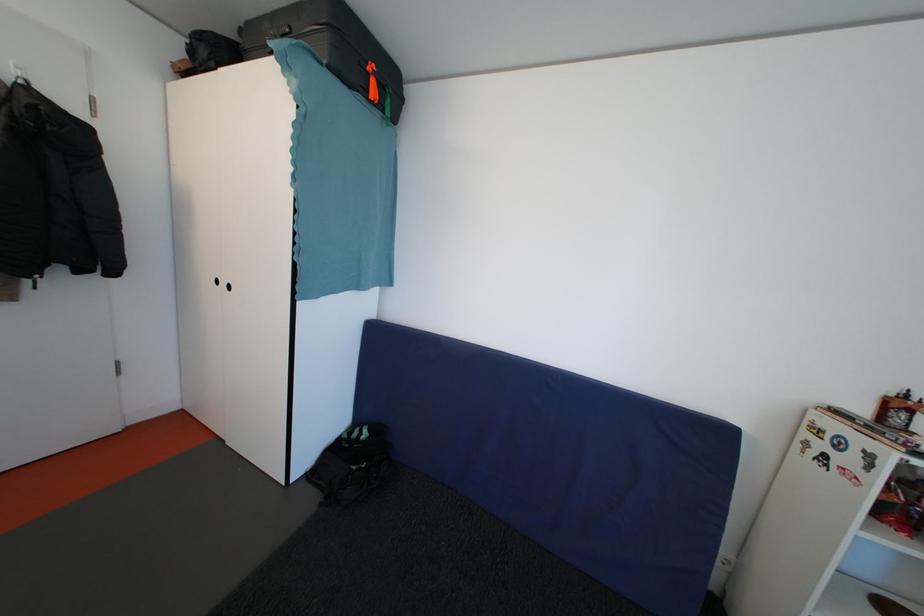
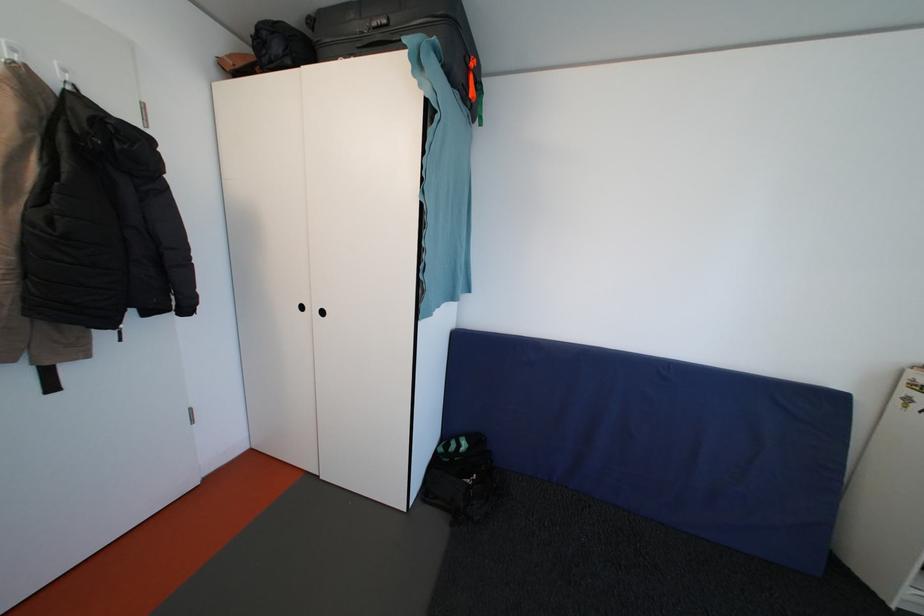
Question: The images are taken continuously from a first-person perspective. In which direction are you moving?

Choices:
 (A) Left
 (B) Right
 (C) Forward
 (D) Backward

Answer: (A)